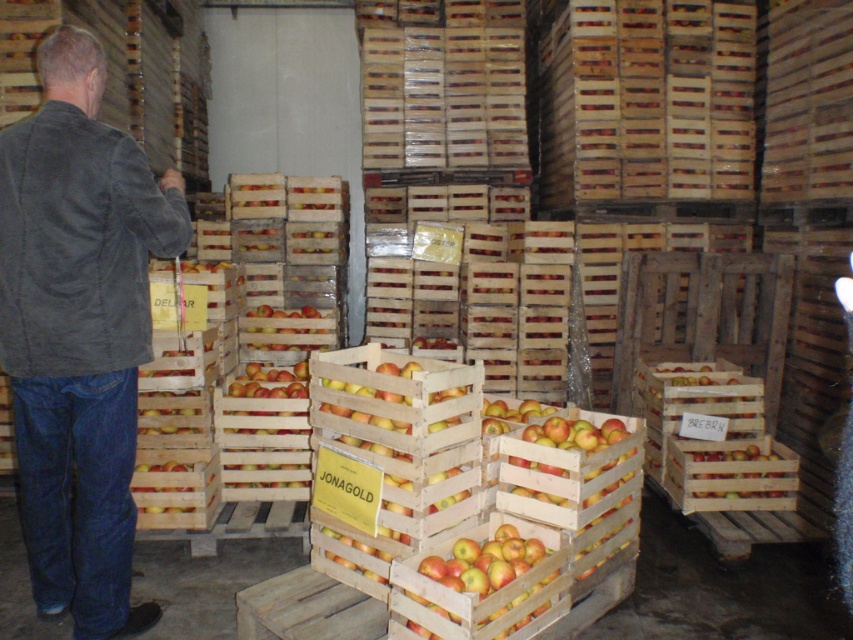
Question: Can you confirm if dark gray corduroy jacket at left is positioned to the left of yellow matte apple at center?

Choices:
 (A) yes
 (B) no

Answer: (A)

Question: Does dark gray suede jacket at left come in front of yellow matte apple at center?

Choices:
 (A) no
 (B) yes

Answer: (B)

Question: Among these objects, which one is farthest from the camera?

Choices:
 (A) yellow matte apple at center
 (B) dark gray corduroy jacket at left
 (C) dark gray suede jacket at left

Answer: (A)

Question: Is dark gray corduroy jacket at left thinner than dark gray suede jacket at left?

Choices:
 (A) yes
 (B) no

Answer: (B)

Question: Estimate the real-world distances between objects in this image. Which object is farther from the dark gray corduroy jacket at left?

Choices:
 (A) dark gray suede jacket at left
 (B) yellow matte apple at center

Answer: (B)

Question: Which point is farther to the camera?

Choices:
 (A) dark gray suede jacket at left
 (B) yellow matte apple at center

Answer: (B)